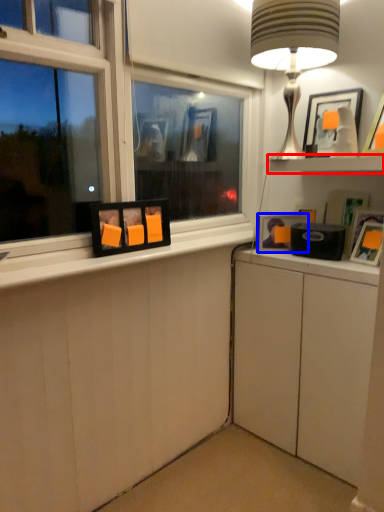
Question: Which object is closer to the camera taking this photo, shelf (highlighted by a red box) or picture frame (highlighted by a blue box)?

Choices:
 (A) shelf
 (B) picture frame

Answer: (A)